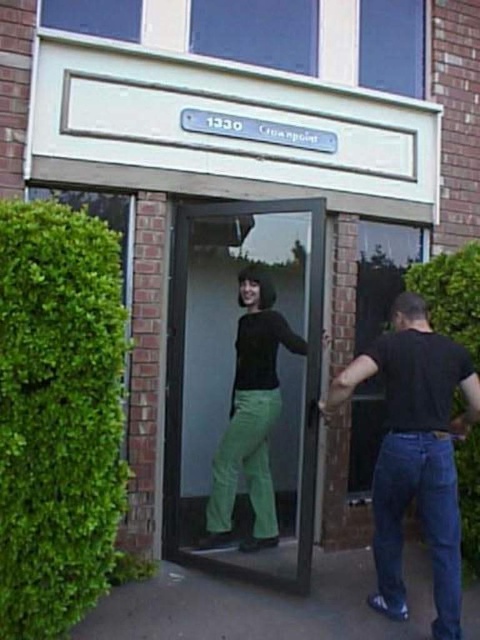
Question: Does transparent glass door at center appear over black cotton shirt at right?

Choices:
 (A) yes
 (B) no

Answer: (A)

Question: Based on their relative distances, which object is nearer to the matte black shirt at center?

Choices:
 (A) transparent glass door at center
 (B) black cotton shirt at right

Answer: (A)

Question: Which point appears closest to the camera in this image?

Choices:
 (A) (238, 484)
 (B) (466, 356)

Answer: (B)

Question: Does transparent glass door at center appear on the right side of matte black shirt at center?

Choices:
 (A) no
 (B) yes

Answer: (A)

Question: Does transparent glass door at center appear over black cotton shirt at right?

Choices:
 (A) yes
 (B) no

Answer: (A)

Question: Which point is closer to the camera?

Choices:
 (A) [x=248, y=369]
 (B) [x=450, y=477]
 (C) [x=236, y=465]

Answer: (B)